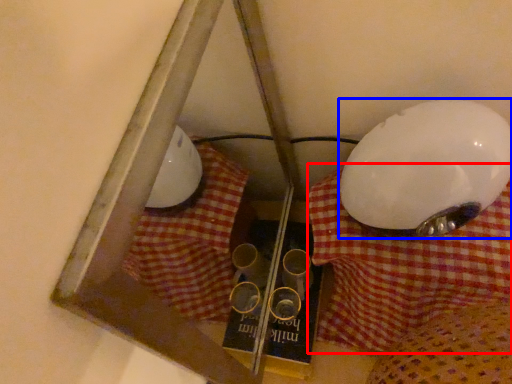
Question: Which point is further to the camera, tablecloth (highlighted by a red box) or lamp (highlighted by a blue box)?

Choices:
 (A) tablecloth
 (B) lamp

Answer: (A)